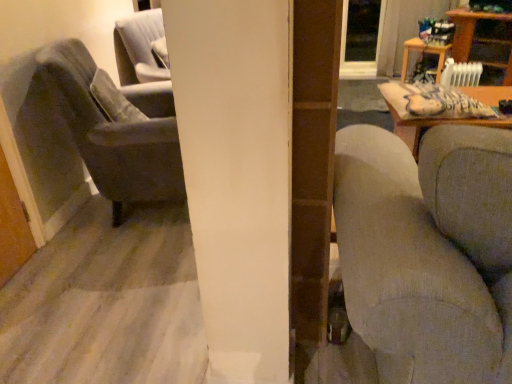
In order to face transparent glass door at upper center, should I rotate leftwards or rightwards?

You should rotate right by 14.350 degrees.

This screenshot has height=384, width=512. What do you see at coordinates (469, 29) in the screenshot?
I see `wooden table at upper right, the second table viewed from the left` at bounding box center [469, 29].

Where is `textured gray couch at right`? This screenshot has width=512, height=384. textured gray couch at right is located at coordinates (428, 251).

What do you see at coordinates (428, 251) in the screenshot? Image resolution: width=512 pixels, height=384 pixels. I see `textured gray couch at right` at bounding box center [428, 251].

You are a GUI agent. You are given a task and a screenshot of the screen. Output one action in this format:
    pyautogui.click(x=<x>, y=<y>)
    Task: Click on the velvet gray armchair at left
    
    Given the screenshot: What is the action you would take?
    pyautogui.click(x=115, y=130)

This screenshot has width=512, height=384. I want to click on transparent glass door at upper center, so click(x=360, y=38).

Between velvet gray armchair at left and textured gray couch at right, which one has smaller size?

velvet gray armchair at left is smaller.

In the scene shown: From a real-world perspective, which is physically below, velvet gray armchair at left or textured gray couch at right?

In real-world perspective, textured gray couch at right is lower.

What's the angular difference between velvet gray armchair at left and textured gray couch at right's facing directions?

72.2 degrees separate the facing orientations of velvet gray armchair at left and textured gray couch at right.

Is velvet gray armchair at left further to the viewer compared to textured gray couch at right?

Yes, it is behind textured gray couch at right.

Is transparent glass door at upper center far from textured gray couch at right?

Yes.

Choose the correct answer: Is transparent glass door at upper center inside textured gray couch at right or outside it?

transparent glass door at upper center cannot be found inside textured gray couch at right.

How far apart are transparent glass door at upper center and textured gray couch at right?

transparent glass door at upper center and textured gray couch at right are 3.68 meters apart.

Locate an element on the screen. This screenshot has width=512, height=384. chair below the wooden table at upper right, placed as the first table when sorted from right to left (from the image's perspective) is located at coordinates (115, 130).

From the picture: Between velvet gray armchair at left and wooden table at upper right, placed as the first table when sorted from right to left, which one is positioned behind?

wooden table at upper right, placed as the first table when sorted from right to left, is further away from the camera.

Does point (111, 111) lie in front of point (473, 13)?

Yes.

Based on their positions, is transparent glass door at upper center located to the left or right of wooden table at upper right, acting as the 1th table starting from the left?

From the image, it's evident that transparent glass door at upper center is to the left of wooden table at upper right, acting as the 1th table starting from the left.

From the image's perspective, is transparent glass door at upper center positioned above or below wooden table at upper right, acting as the 1th table starting from the left?

transparent glass door at upper center is situated higher than wooden table at upper right, acting as the 1th table starting from the left, in the image.

Is transparent glass door at upper center oriented towards wooden table at upper right, the second table when ordered from right to left?

No, transparent glass door at upper center is not facing towards wooden table at upper right, the second table when ordered from right to left.

From a real-world perspective, is transparent glass door at upper center positioned over wooden table at upper right, the second table when ordered from right to left, based on gravity?

Yes, from a real-world perspective, transparent glass door at upper center is above wooden table at upper right, the second table when ordered from right to left.

Can you tell me how much wooden table at upper right, placed as the first table when sorted from right to left, and velvet gray armchair at left differ in facing direction?

The angular difference between wooden table at upper right, placed as the first table when sorted from right to left, and velvet gray armchair at left is 142 degrees.

Is wooden table at upper right, placed as the first table when sorted from right to left, turned away from velvet gray armchair at left?

wooden table at upper right, placed as the first table when sorted from right to left, is not turned away from velvet gray armchair at left.

From the picture: Considering the sizes of objects wooden table at upper right, placed as the first table when sorted from right to left, and velvet gray armchair at left in the image provided, who is taller, wooden table at upper right, placed as the first table when sorted from right to left, or velvet gray armchair at left?

velvet gray armchair at left is taller.

Does wooden table at upper right, acting as the 1th table starting from the left, have a lesser width compared to velvet gray armchair at left?

Indeed, wooden table at upper right, acting as the 1th table starting from the left, has a lesser width compared to velvet gray armchair at left.

Locate an element on the screen. The height and width of the screenshot is (384, 512). chair positioned vertically above the wooden table at upper right, acting as the 1th table starting from the left (from a real-world perspective) is located at coordinates (115, 130).

From the image's perspective, is velvet gray armchair at left located above wooden table at upper right, acting as the 1th table starting from the left?

No, from the image's perspective, velvet gray armchair at left is not above wooden table at upper right, acting as the 1th table starting from the left.

Do you think velvet gray armchair at left is within wooden table at upper right, acting as the 1th table starting from the left, or outside of it?

velvet gray armchair at left is not inside wooden table at upper right, acting as the 1th table starting from the left, it's outside.

Considering the sizes of objects velvet gray armchair at left and wooden table at upper right, the second table when ordered from right to left, in the image provided, who is bigger, velvet gray armchair at left or wooden table at upper right, the second table when ordered from right to left,?

velvet gray armchair at left is bigger.

Identify the location of chair above the textured gray couch at right (from the image's perspective). (115, 130).

This screenshot has width=512, height=384. What are the coordinates of `studio couch in front of the transparent glass door at upper center` in the screenshot? It's located at (428, 251).

Estimate the real-world distances between objects in this image. Which object is further from wooden table at upper right, the second table viewed from the left, textured gray couch at right or transparent glass door at upper center?

textured gray couch at right lies further to wooden table at upper right, the second table viewed from the left, than the other object.

Consider the image. From the image, which object appears to be nearer to wooden table at upper right, placed as the first table when sorted from right to left, wooden table at upper right, the second table when ordered from right to left, or velvet gray armchair at left?

wooden table at upper right, the second table when ordered from right to left, lies closer to wooden table at upper right, placed as the first table when sorted from right to left, than the other object.

Based on their spatial positions, is wooden table at upper right, acting as the 1th table starting from the left, or transparent glass door at upper center closer to wooden table at upper right, the second table viewed from the left?

wooden table at upper right, acting as the 1th table starting from the left.

Based on their spatial positions, is transparent glass door at upper center or wooden table at upper right, the second table when ordered from right to left, further from wooden table at upper right, placed as the first table when sorted from right to left?

transparent glass door at upper center is further to wooden table at upper right, placed as the first table when sorted from right to left.

Based on their spatial positions, is wooden table at upper right, placed as the first table when sorted from right to left, or textured gray couch at right further from wooden table at upper right, acting as the 1th table starting from the left?

textured gray couch at right.

Estimate the real-world distances between objects in this image. Which object is closer to wooden table at upper right, the second table viewed from the left, velvet gray armchair at left or wooden table at upper right, the second table when ordered from right to left?

Among the two, wooden table at upper right, the second table when ordered from right to left, is located nearer to wooden table at upper right, the second table viewed from the left.

Based on their spatial positions, is wooden table at upper right, placed as the first table when sorted from right to left, or velvet gray armchair at left further from transparent glass door at upper center?

velvet gray armchair at left.

Which object lies further to the anchor point transparent glass door at upper center, wooden table at upper right, the second table viewed from the left, or textured gray couch at right?

textured gray couch at right is further to transparent glass door at upper center.

In order to click on table between velvet gray armchair at left and wooden table at upper right, the second table viewed from the left in this screenshot , I will do `click(422, 54)`.

Where is `table between textured gray couch at right and wooden table at upper right, acting as the 1th table starting from the left, from front to back`? The height and width of the screenshot is (384, 512). table between textured gray couch at right and wooden table at upper right, acting as the 1th table starting from the left, from front to back is located at coordinates (469, 29).

Identify the location of chair positioned between textured gray couch at right and transparent glass door at upper center from near to far. (115, 130).

Locate an element on the screen. This screenshot has height=384, width=512. chair between textured gray couch at right and wooden table at upper right, the second table when ordered from right to left, along the z-axis is located at coordinates 115,130.